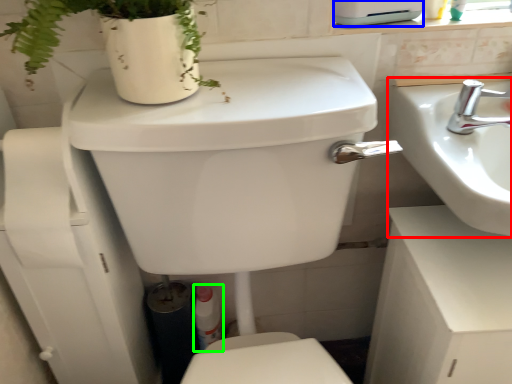
Question: Which is farther away from sink (highlighted by a red box)? appliance (highlighted by a blue box) or toiletry (highlighted by a green box)?

Choices:
 (A) appliance
 (B) toiletry

Answer: (B)